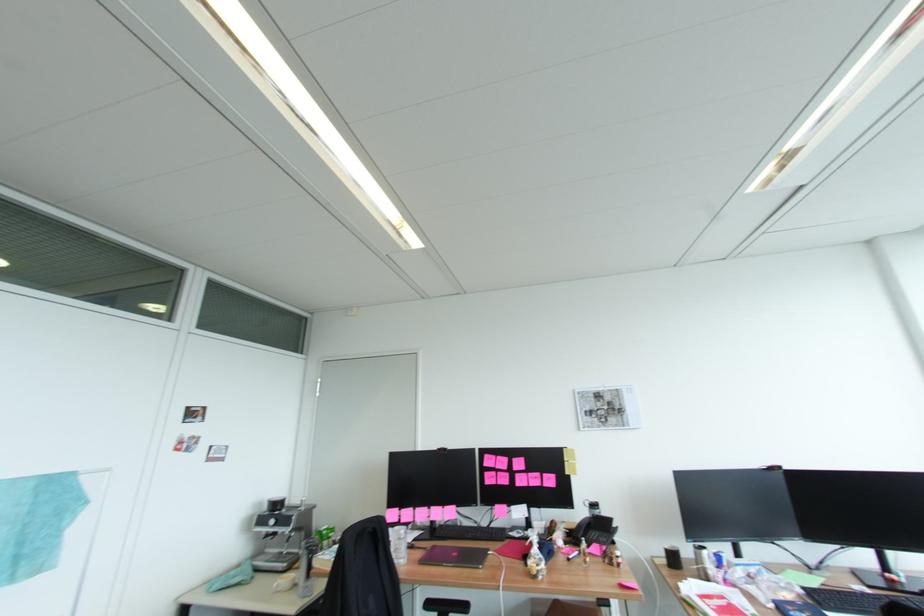
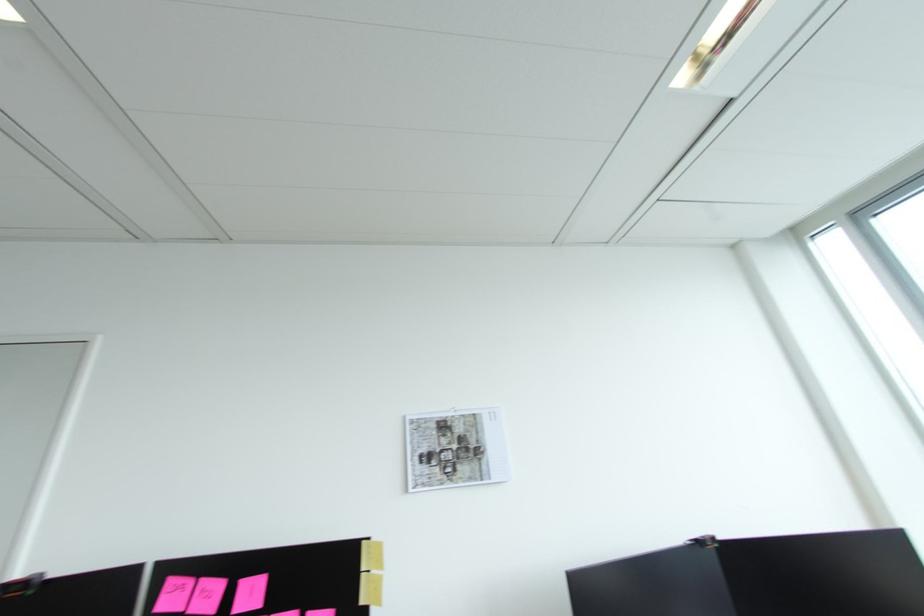
In the second image, find the point that corresponds to the point at 569,448 in the first image.

(368, 541)